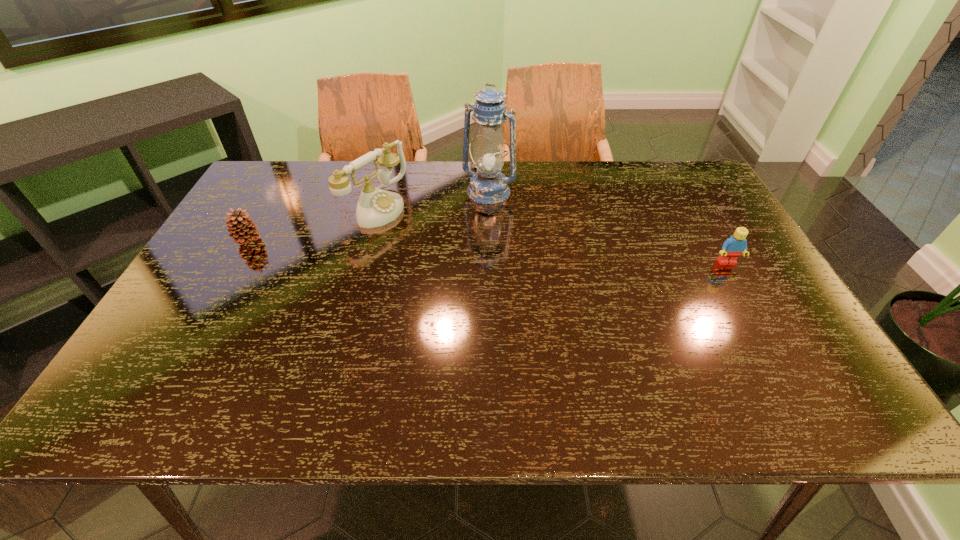
What are the coordinates of `pinecone` in the screenshot? It's located at (241, 227).

Identify the location of the leftmost object. (241, 227).

Identify the location of the nearest object. (734, 246).

Locate an element on the screen. Image resolution: width=960 pixels, height=540 pixels. the rightmost object is located at coordinates (734, 246).

Find the location of a particular element. This screenshot has height=540, width=960. lantern is located at coordinates (488, 186).

At what (x,y) coordinates should I click in order to perform the action: click on the tallest object. Please return your answer as a coordinate pair (x, y). Looking at the image, I should click on (488, 186).

Locate an element on the screen. Image resolution: width=960 pixels, height=540 pixels. the second tallest object is located at coordinates (376, 207).

Where is `telephone`? The height and width of the screenshot is (540, 960). telephone is located at coordinates (376, 207).

Locate an element on the screen. vacant space positioned 0.080m on the front of the third farthest object is located at coordinates (231, 269).

The image size is (960, 540). What are the coordinates of `free space located on the face of the nearest object` in the screenshot? It's located at (777, 348).